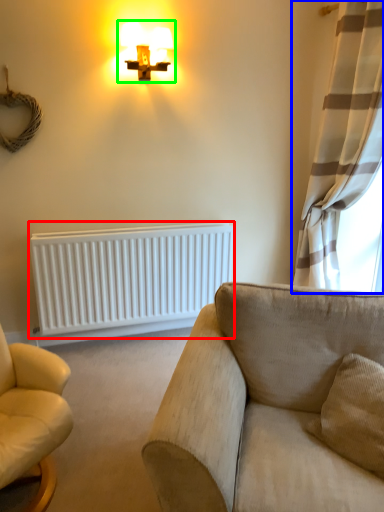
Question: Which object is positioned farthest from radiator (highlighted by a red box)? Select from curtain (highlighted by a blue box) and lamp (highlighted by a green box).

Choices:
 (A) curtain
 (B) lamp

Answer: (B)